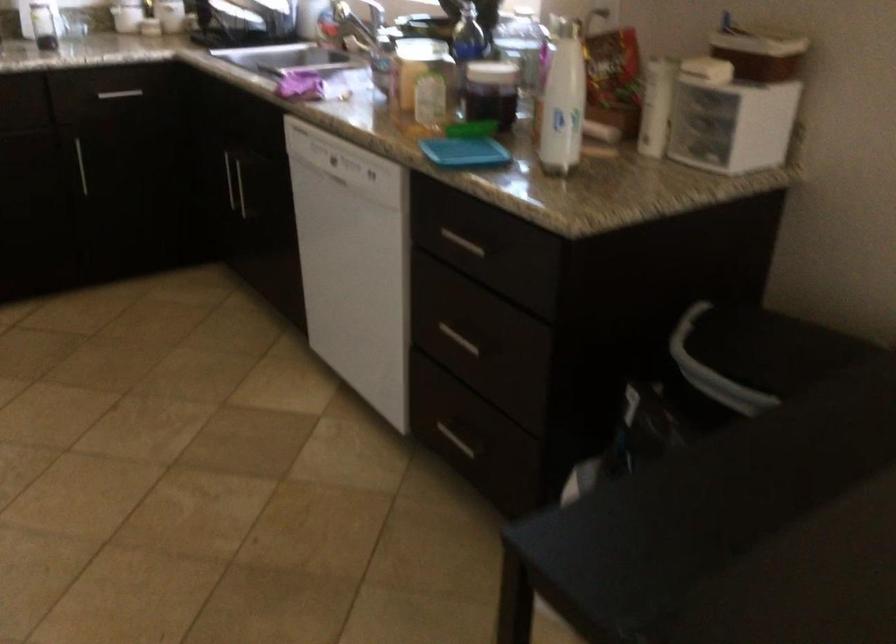
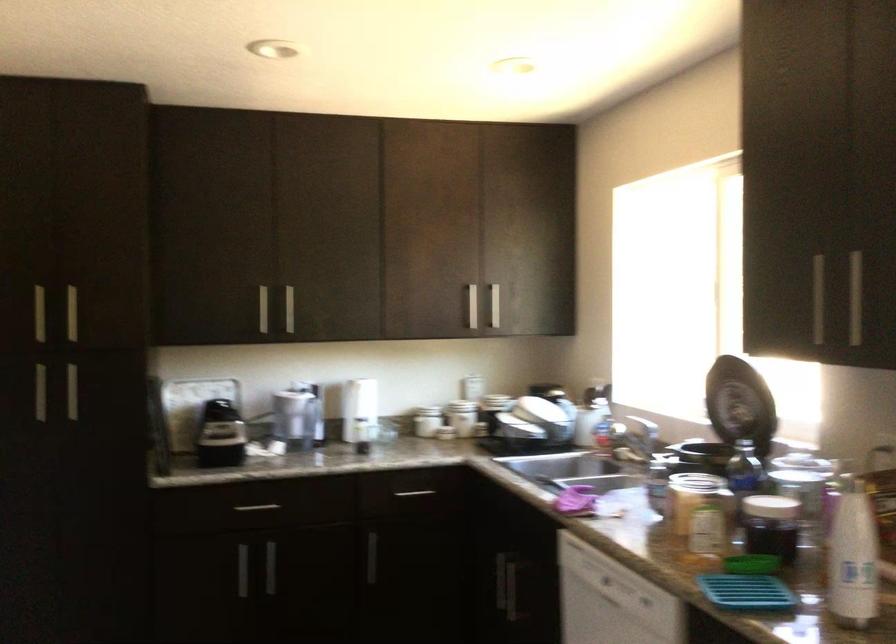
The point at (117,91) is marked in the first image. Where is the corresponding point in the second image?

(414, 493)